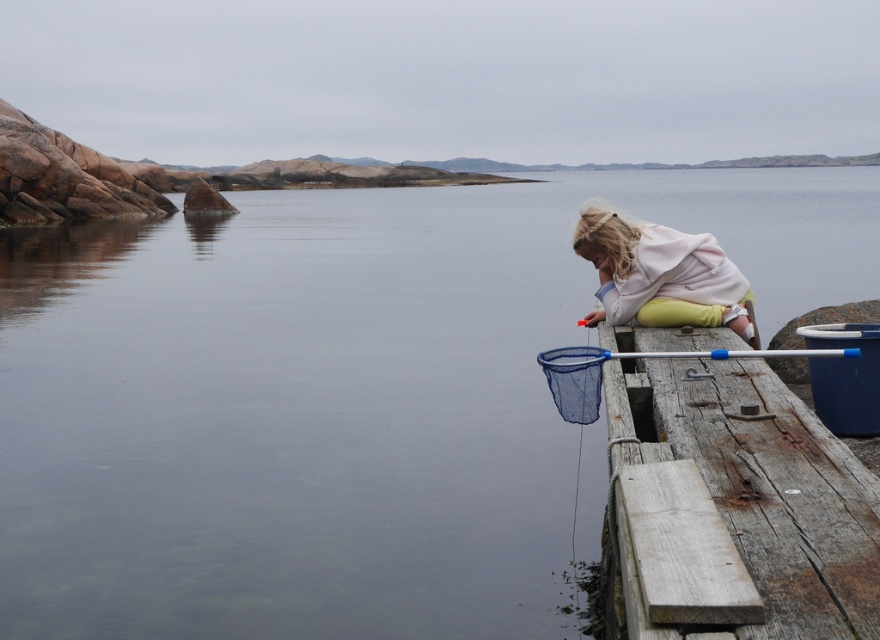
Question: Is clear water at dock right positioned in front of blue plastic fishing pole at right?

Choices:
 (A) yes
 (B) no

Answer: (B)

Question: Which point is closer to the camera?

Choices:
 (A) weathered wood dock at lower right
 (B) blue plastic fishing pole at right
 (C) light pink fleece at right
 (D) clear water at dock right

Answer: (A)

Question: Which is farther from the blue plastic fishing pole at right?

Choices:
 (A) clear water at dock right
 (B) light pink fleece at right
 (C) weathered wood dock at lower right

Answer: (A)

Question: Observing the image, what is the correct spatial positioning of clear water at dock right in reference to blue plastic fishing pole at right?

Choices:
 (A) above
 (B) below

Answer: (A)

Question: Which object appears farthest from the camera in this image?

Choices:
 (A) clear water at dock right
 (B) blue plastic fishing pole at right
 (C) light pink fleece at right

Answer: (C)

Question: Where is clear water at dock right located in relation to light pink fleece at right in the image?

Choices:
 (A) right
 (B) left

Answer: (B)